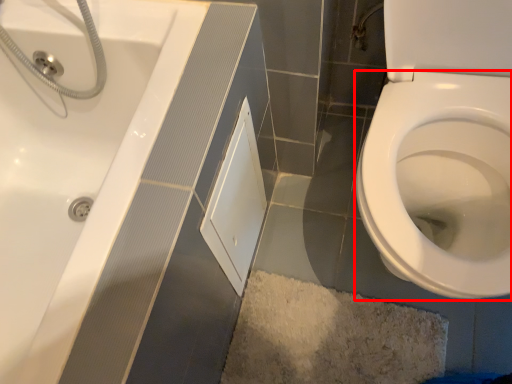
Question: From the image's perspective, where is bidet (annotated by the red box) located in relation to screen door in the image?

Choices:
 (A) below
 (B) above

Answer: (B)